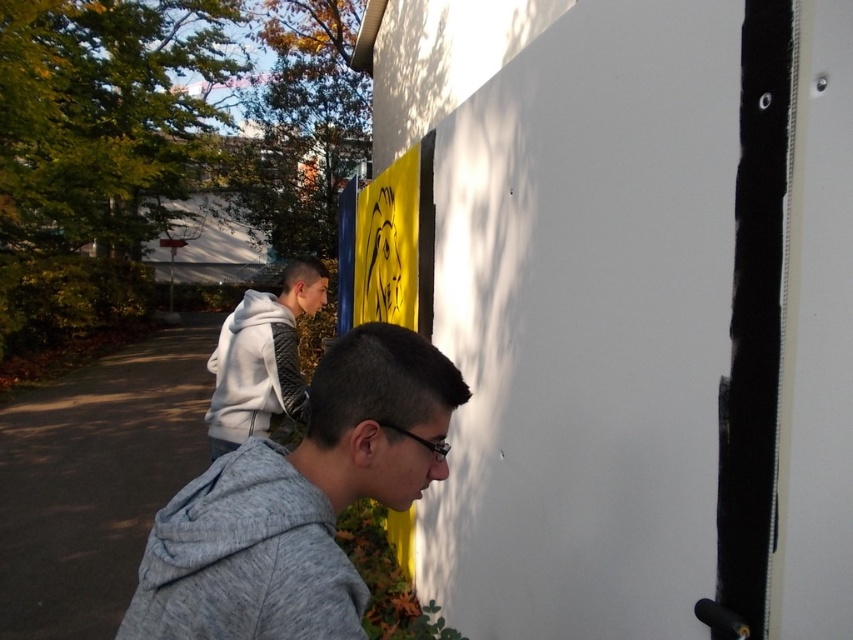
You are a photographer trying to capture a photo of the gray fleece jacket at lower left and the white hoodie at upper left. Since you want both subjects in focus, you need to know which one is closer to you. Can you determine which is closer?

The gray fleece jacket at lower left is positioned over the white hoodie at upper left, so the gray fleece jacket at lower left is closer to you.

You are standing at the center of the path and looking towards the building in the background. Which of the two people, the gray heathered sweatshirt at lower left or the white hoodie at upper left, is closer to you?

The gray heathered sweatshirt at lower left is closer to you because it is positioned above the white hoodie at upper left in the image, indicating it is nearer in the foreground.

You are a photographer trying to capture both the gray fleece jacket at lower left and the gray heathered sweatshirt at lower left in a single frame. Since you can only focus on one subject at a time, which one should you focus on to ensure the other remains in the background?

You should focus on the gray fleece jacket at lower left because it is taller than the gray heathered sweatshirt at lower left, so the shorter one will naturally be in the background when focusing on the taller one.